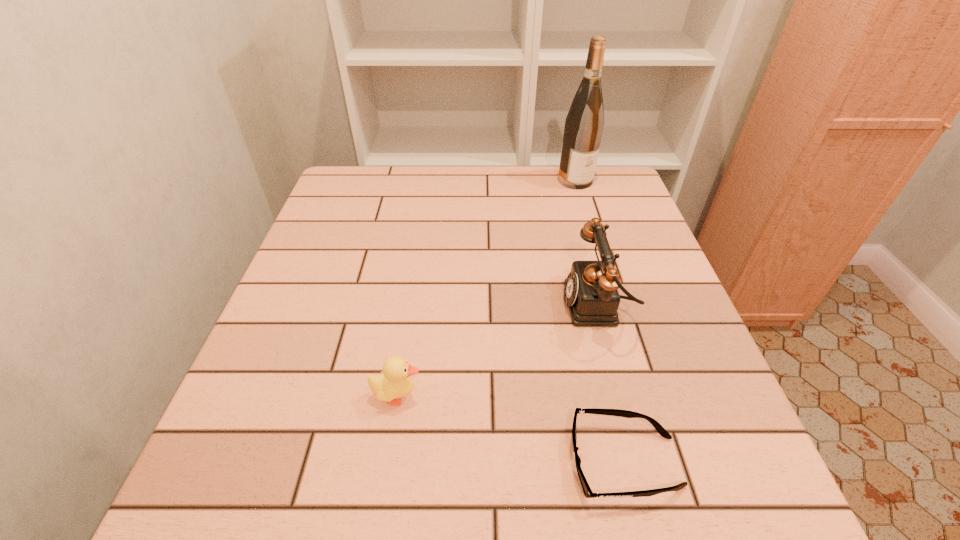
The width and height of the screenshot is (960, 540). I want to click on the farthest object, so click(x=584, y=123).

Locate an element on the screen. Image resolution: width=960 pixels, height=540 pixels. the tallest object is located at coordinates (584, 123).

Find the location of a particular element. telephone is located at coordinates (592, 296).

Where is `the third nearest object`? The width and height of the screenshot is (960, 540). the third nearest object is located at coordinates [592, 296].

I want to click on duckling, so click(394, 383).

Where is `the leftmost object`? the leftmost object is located at coordinates (394, 383).

The height and width of the screenshot is (540, 960). Identify the location of the nearest object. (588, 493).

You are a GUI agent. You are given a task and a screenshot of the screen. Output one action in this format:
    pyautogui.click(x=<x>, y=<y>)
    Task: Click on the sunglasses
    The image size is (960, 540).
    Given the screenshot: What is the action you would take?
    pyautogui.click(x=588, y=493)

Where is `free space located 0.130m on the left of the farthest object`? The width and height of the screenshot is (960, 540). free space located 0.130m on the left of the farthest object is located at coordinates tap(514, 180).

The height and width of the screenshot is (540, 960). In order to click on free point located 0.260m on the front of the second farthest object at the rotary dial in this screenshot , I will do `click(440, 306)`.